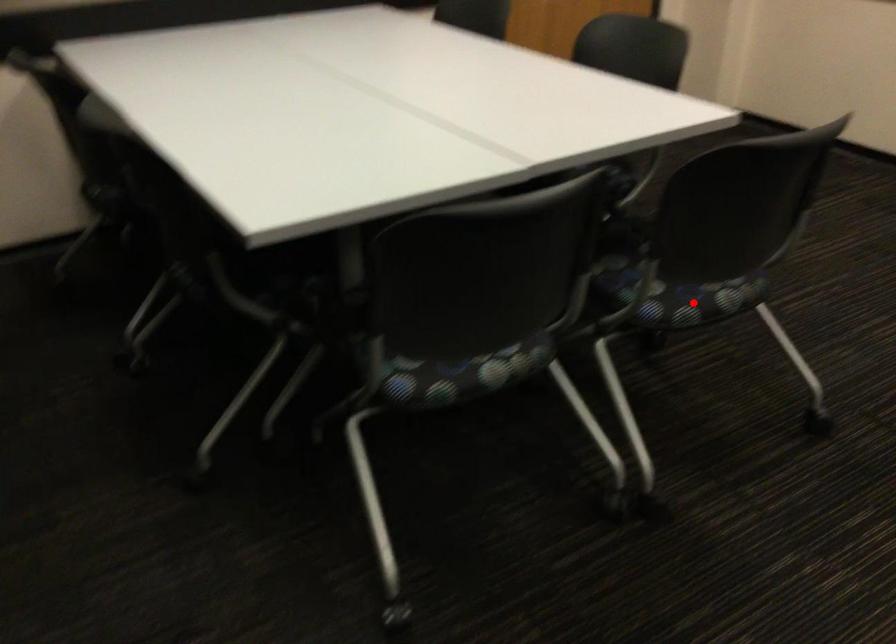
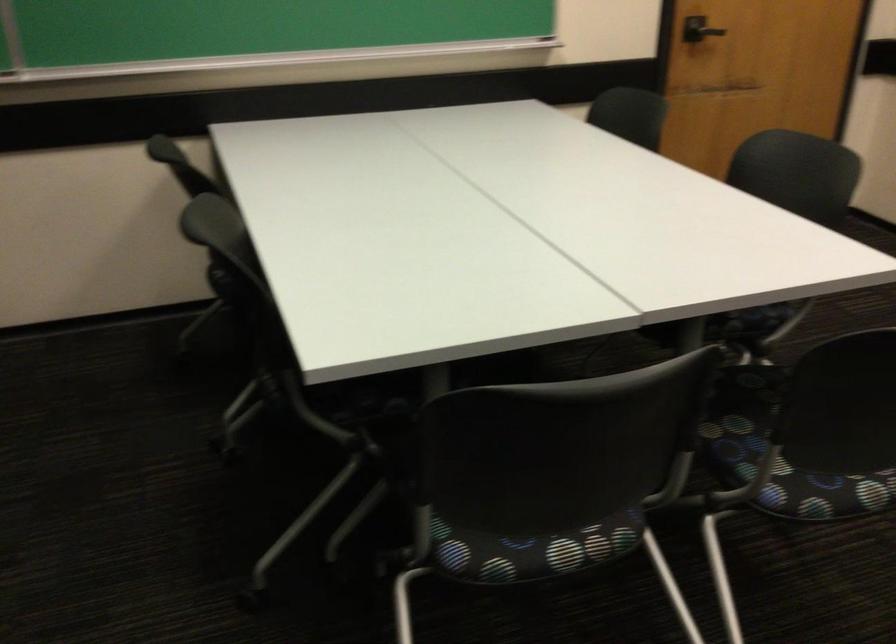
Question: I am providing you with two images of the same scene from different viewpoints. A red point is marked on the first image. Is the red point's position out of view in image 2?

Choices:
 (A) Yes
 (B) No

Answer: (B)